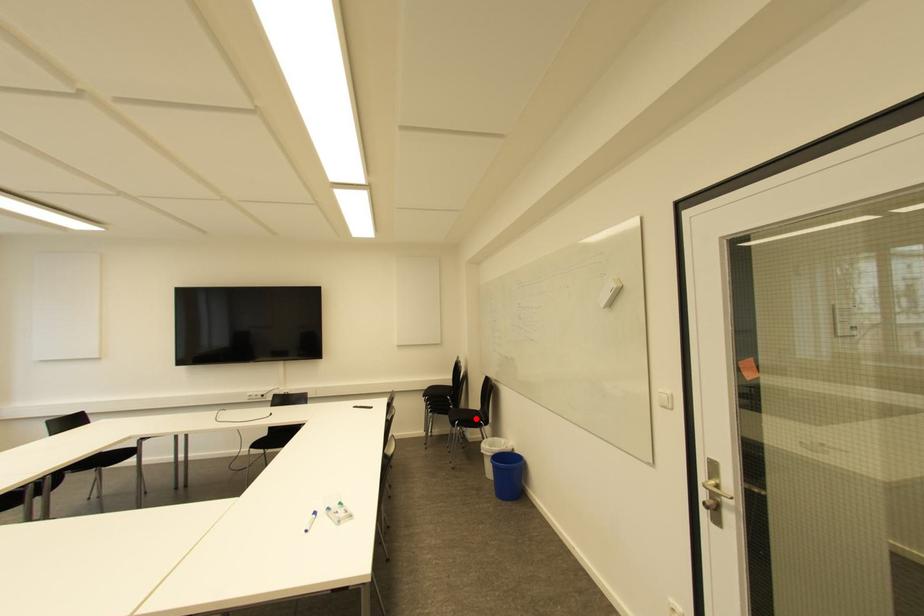
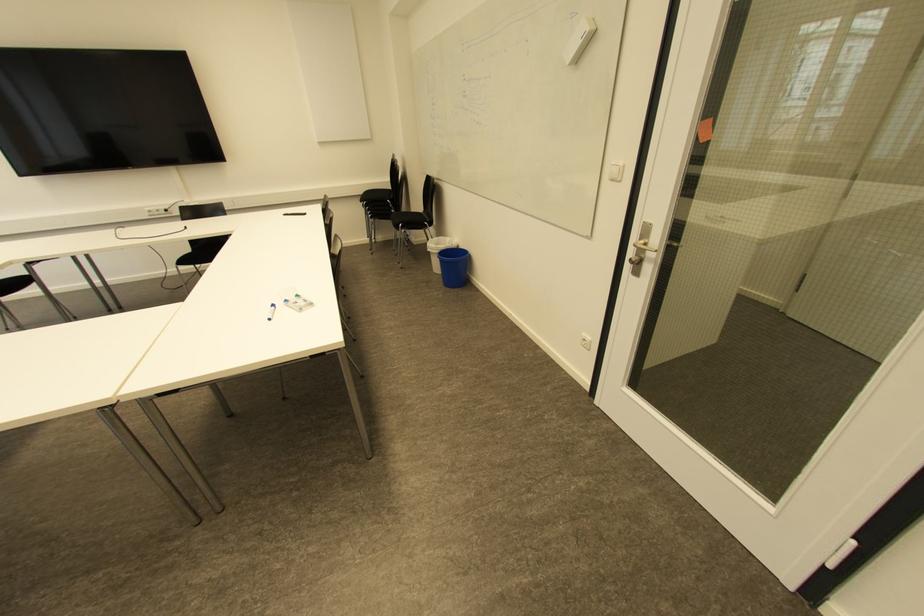
Question: I am providing you with two images of the same scene from different viewpoints. Image1 has a red point marked. In image2, the corresponding 3D location appears at what relative position? Reply with the corresponding letter.

Choices:
 (A) Closer
 (B) Farther

Answer: (A)